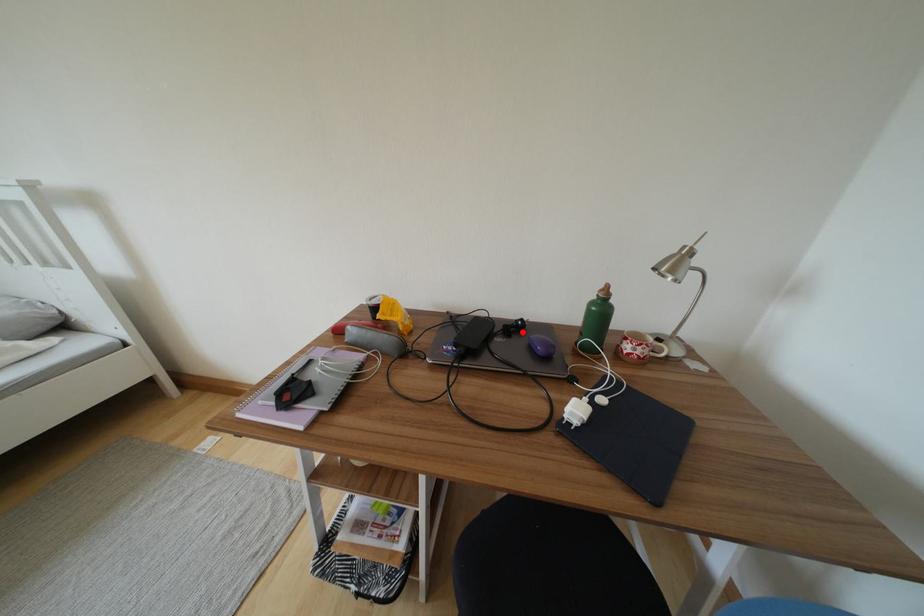
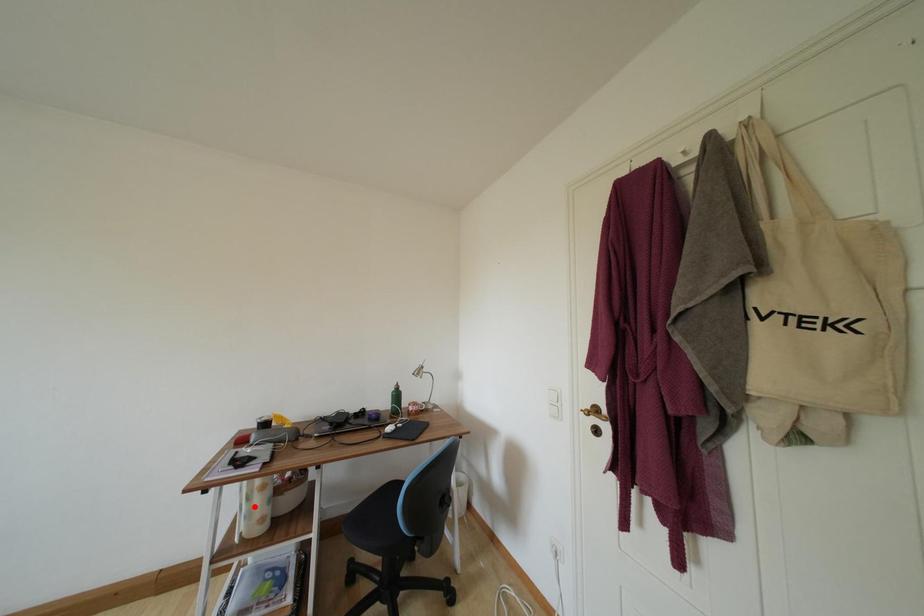
I am providing you with two images of the same scene from different viewpoints. A red point is marked on the first image and another point is marked on the second image. Do the highlighted points in image1 and image2 indicate the same real-world spot?

No